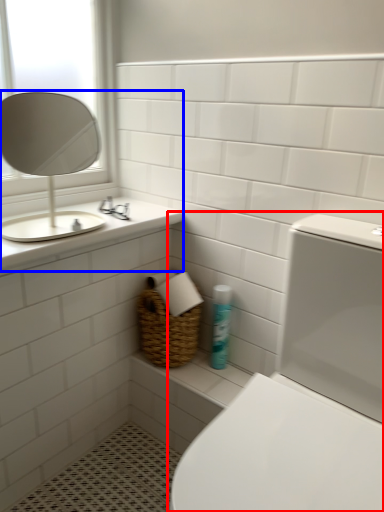
Question: Which object is further to the camera taking this photo, toilet (highlighted by a red box) or sink (highlighted by a blue box)?

Choices:
 (A) toilet
 (B) sink

Answer: (B)